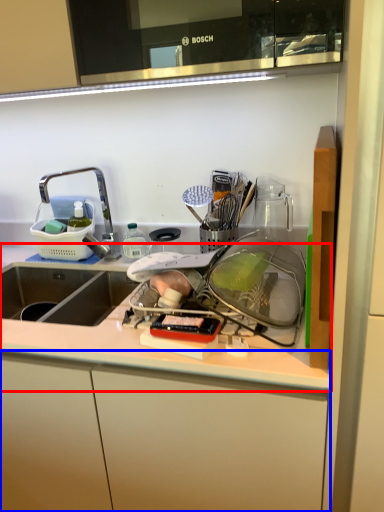
Question: Which object appears farthest to the camera in this image, countertop (highlighted by a red box) or cabinetry (highlighted by a blue box)?

Choices:
 (A) countertop
 (B) cabinetry

Answer: (B)